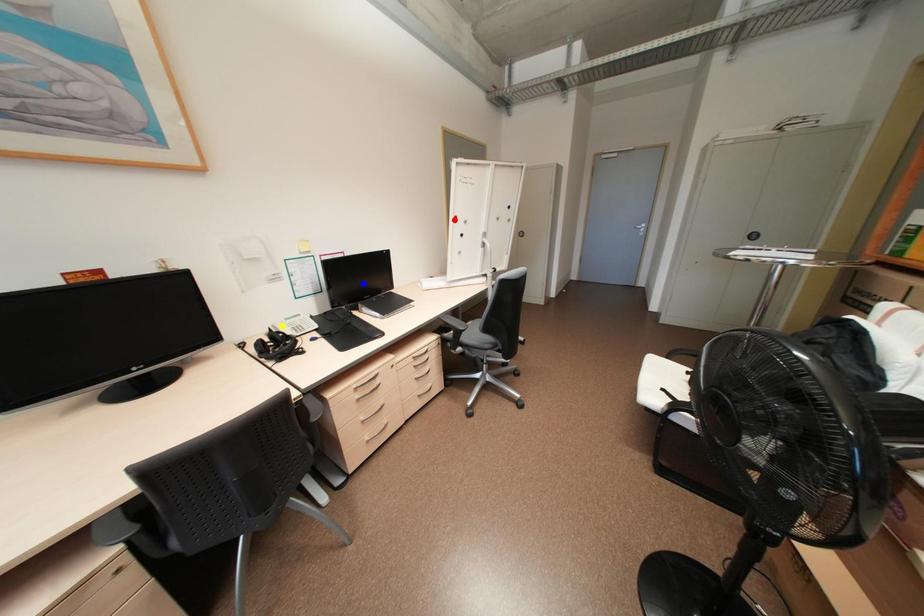
Order these from farthest to nearest:
yellow point
blue point
red point

1. red point
2. blue point
3. yellow point